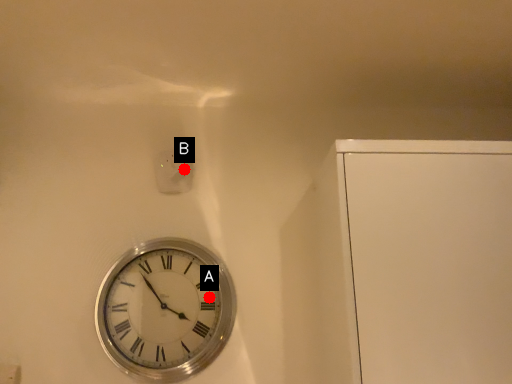
Question: Two points are circled on the image, labeled by A and B beside each circle. Which point is closer to the camera?

Choices:
 (A) A is closer
 (B) B is closer

Answer: (A)